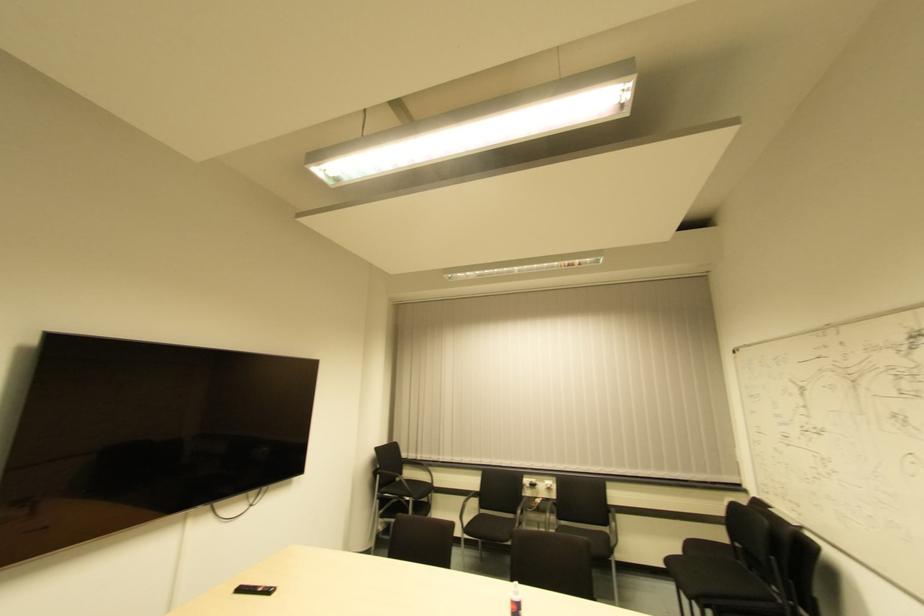
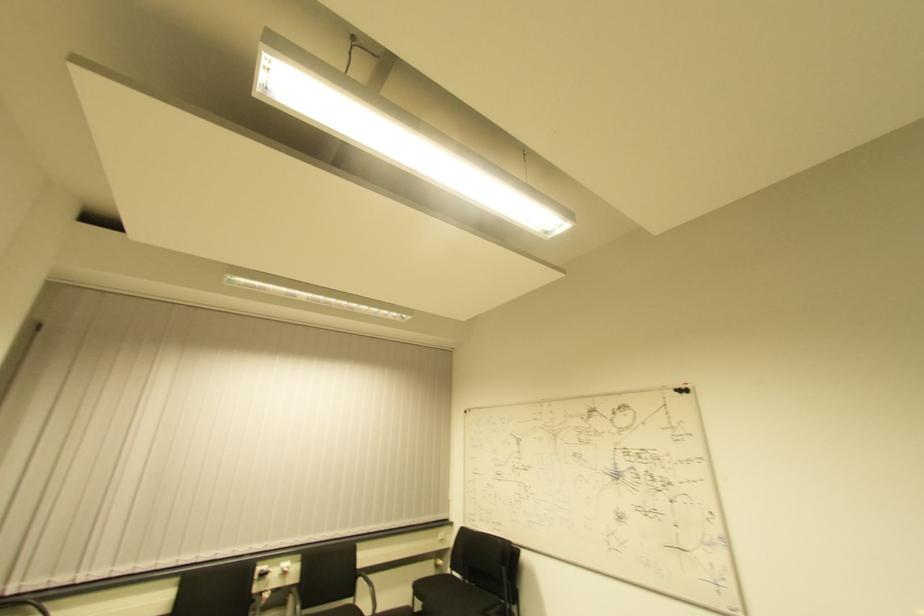
Where in the second image is the point corresponding to (x=546, y=492) from the first image?

(283, 576)